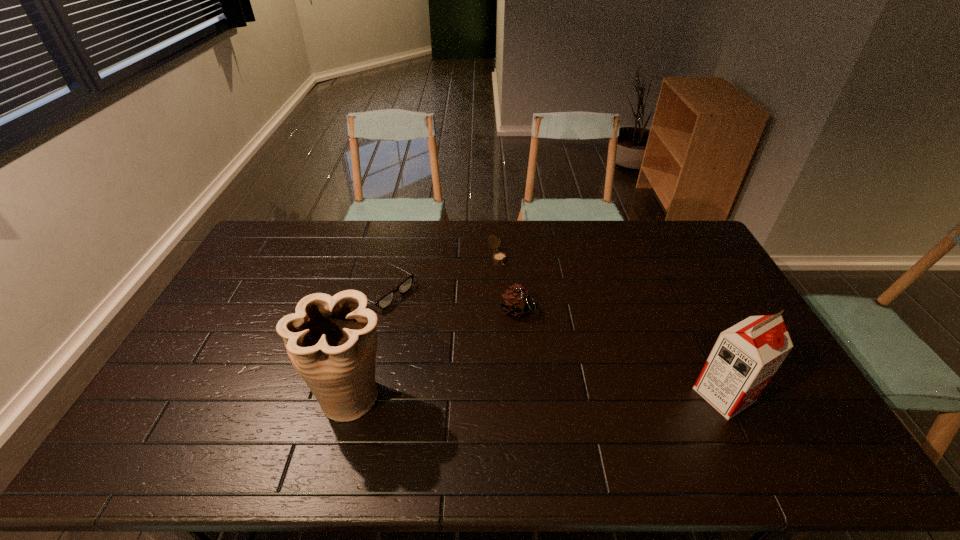
Where is `object located at the right edge`? object located at the right edge is located at coordinates (745, 357).

Locate an element on the screen. The width and height of the screenshot is (960, 540). object positioned at the near right corner is located at coordinates (745, 357).

The height and width of the screenshot is (540, 960). Identify the location of vacant area at the far edge. [x=390, y=235].

Image resolution: width=960 pixels, height=540 pixels. I want to click on vacant position at the near edge of the desktop, so click(522, 419).

You are a GUI agent. You are given a task and a screenshot of the screen. Output one action in this format:
    pyautogui.click(x=<x>, y=<y>)
    Task: Click on the free space at the left edge
    Image resolution: width=960 pixels, height=540 pixels.
    Given the screenshot: What is the action you would take?
    pyautogui.click(x=183, y=381)

In order to click on free space at the right edge of the desktop in this screenshot , I will do `click(686, 290)`.

The image size is (960, 540). I want to click on vacant region at the far left corner, so click(x=264, y=246).

The image size is (960, 540). I want to click on vacant area at the far right corner, so click(671, 233).

The image size is (960, 540). I want to click on vacant space at the near right corner of the desktop, so click(793, 395).

Where is `free area in between the shortest object and the compass`? free area in between the shortest object and the compass is located at coordinates (440, 274).